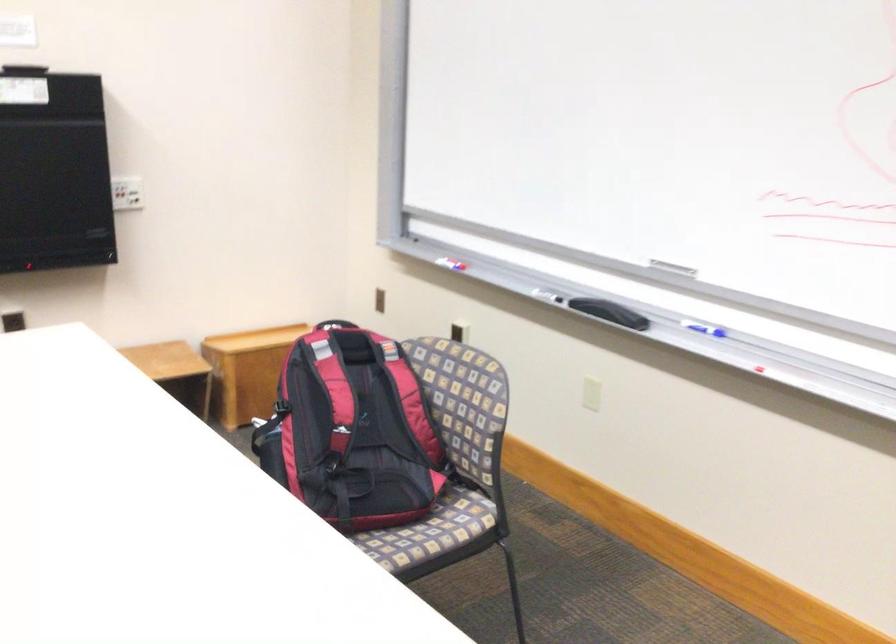
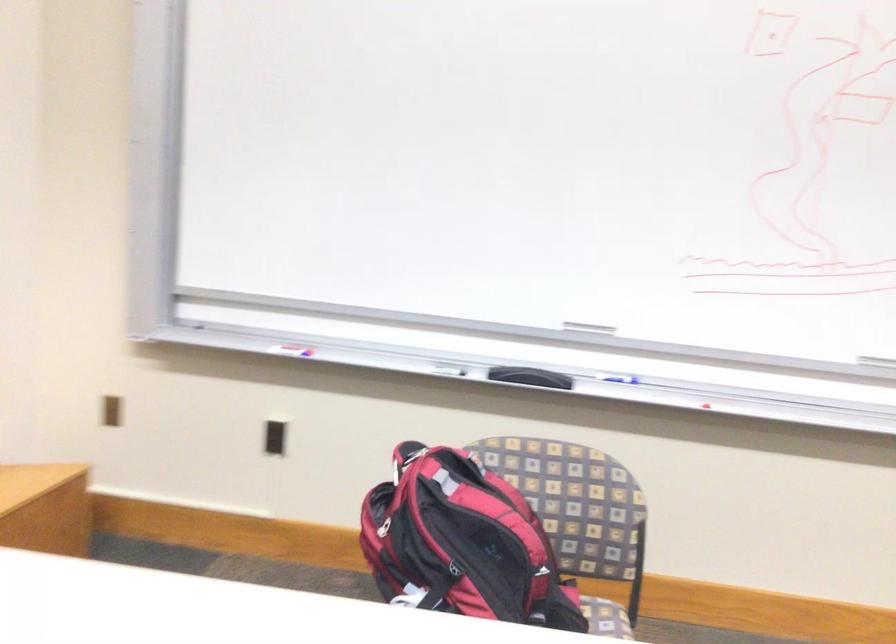
In the second image, find the point that corresponds to point 297,374 in the first image.

(383, 527)